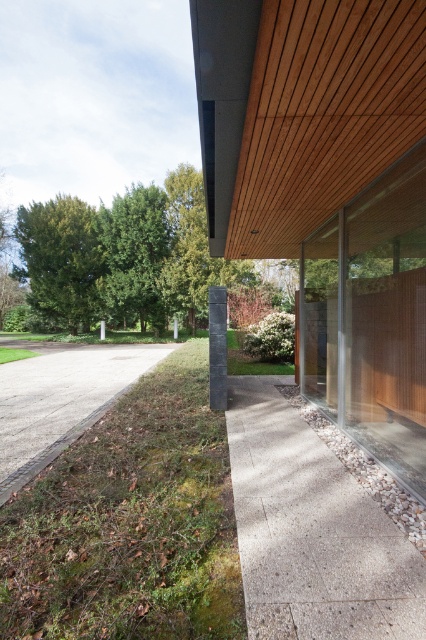
Does concrete textured driveway at lower right have a larger size compared to gravel driveway at lower left?

No, concrete textured driveway at lower right is not bigger than gravel driveway at lower left.

Between point (354, 499) and point (8, 497), which one is positioned behind?

Point (8, 497)

Where is `concrete textured driveway at lower right`? This screenshot has width=426, height=640. concrete textured driveway at lower right is located at coordinates (311, 531).

The height and width of the screenshot is (640, 426). I want to click on concrete textured driveway at lower right, so click(x=311, y=531).